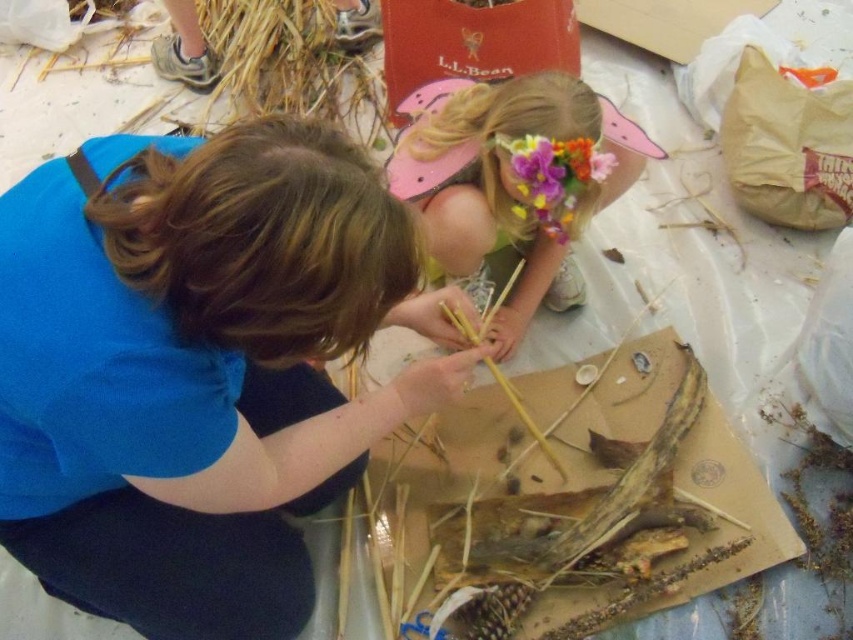
Based on the photo, you are a craft designer who wants to place a decorative item on a shelf. The shelf has limited vertical space. Which object between the floral paper crown at upper center and the smooth straw at center would you choose to place on the shelf without exceeding the height limit?

The smooth straw at center has a smaller height compared to the floral paper crown at upper center, so you should choose the smooth straw at center to place on the shelf without exceeding the height limit.

You are a photographer trying to capture the blue fabric shirt at upper left and the smooth straw at center in the same frame. Based on their positions, can you tell which object is closer to the bottom of the image?

The blue fabric shirt at upper left is located below smooth straw at center, so the blue fabric shirt at upper left is closer to the bottom of the image.

You are a photographer trying to capture a clear shot of the floral paper crown at upper center without the blue fabric shirt at upper left blocking it. Can you adjust your position to do so?

The blue fabric shirt at upper left is in front of the floral paper crown at upper center, so you need to move your camera position to the side or behind the blue fabric shirt at upper left to avoid blocking the view of the floral paper crown at upper center.